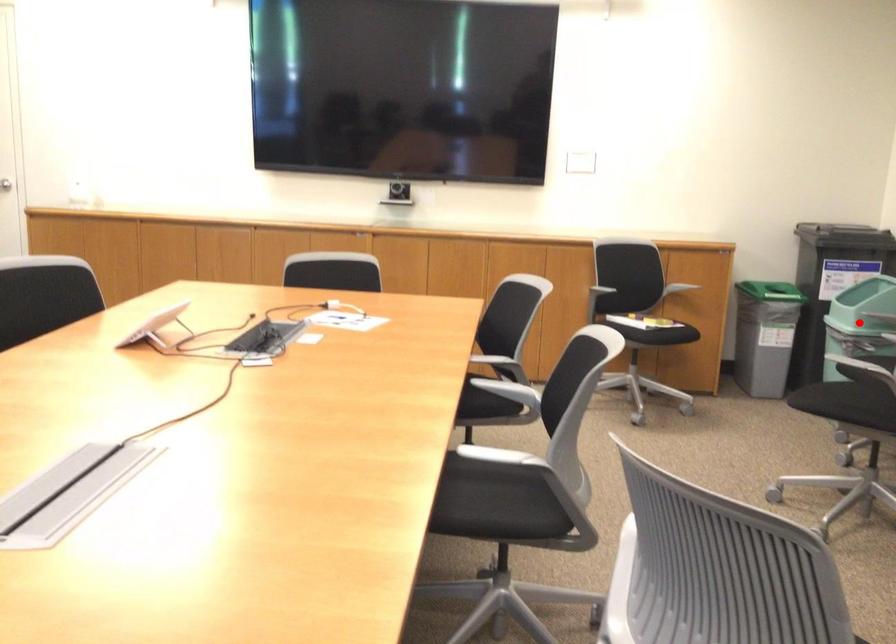
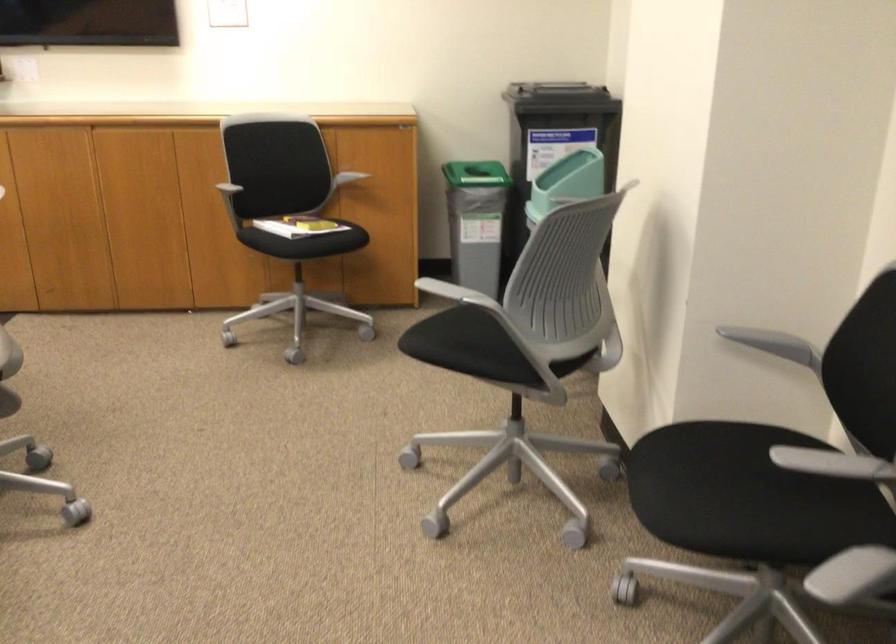
Question: I am providing you with two images of the same scene from different viewpoints. A red point is marked on the first image. Is the red point's position out of view in image 2?

Choices:
 (A) Yes
 (B) No

Answer: (A)